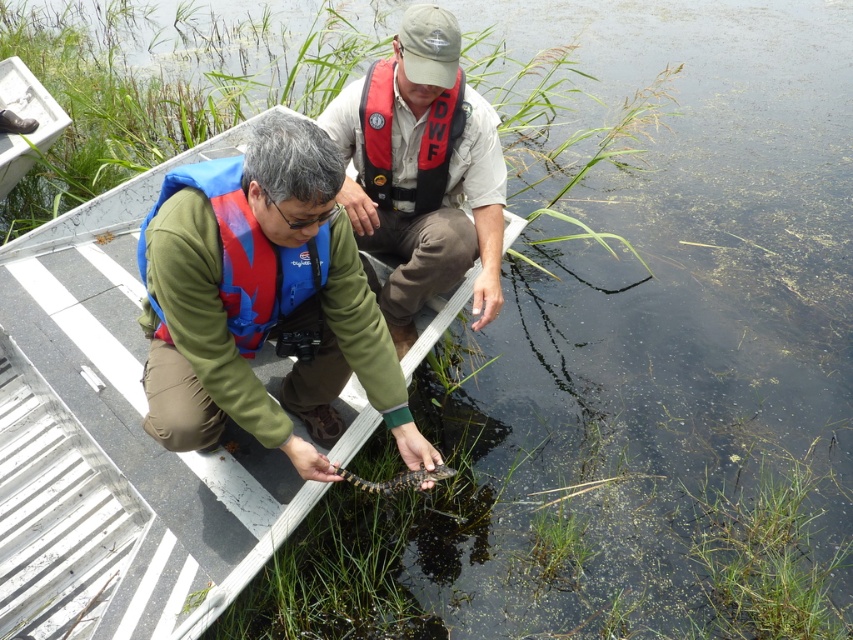
Question: Which of these objects is positioned closest to the red nylon life jacket at center?

Choices:
 (A) matte khaki shirt at center
 (B) metallic aluminum boat at center
 (C) blue fabric life jacket at lower left

Answer: (A)

Question: Which object is farther from the camera taking this photo?

Choices:
 (A) red nylon life jacket at center
 (B) blue fabric life vest at lower left
 (C) matte khaki shirt at center

Answer: (A)

Question: Which of the following is the closest to the observer?

Choices:
 (A) coord(395,216)
 (B) coord(344,412)
 (C) coord(283,333)
 (D) coord(463,115)

Answer: (C)

Question: Can you confirm if metallic aluminum boat at center is thinner than blue fabric life jacket at lower left?

Choices:
 (A) no
 (B) yes

Answer: (A)

Question: Does metallic aluminum boat at center have a greater width compared to blue fabric life jacket at lower left?

Choices:
 (A) yes
 (B) no

Answer: (A)

Question: Does blue fabric life vest at lower left have a greater width compared to matte khaki shirt at center?

Choices:
 (A) yes
 (B) no

Answer: (A)